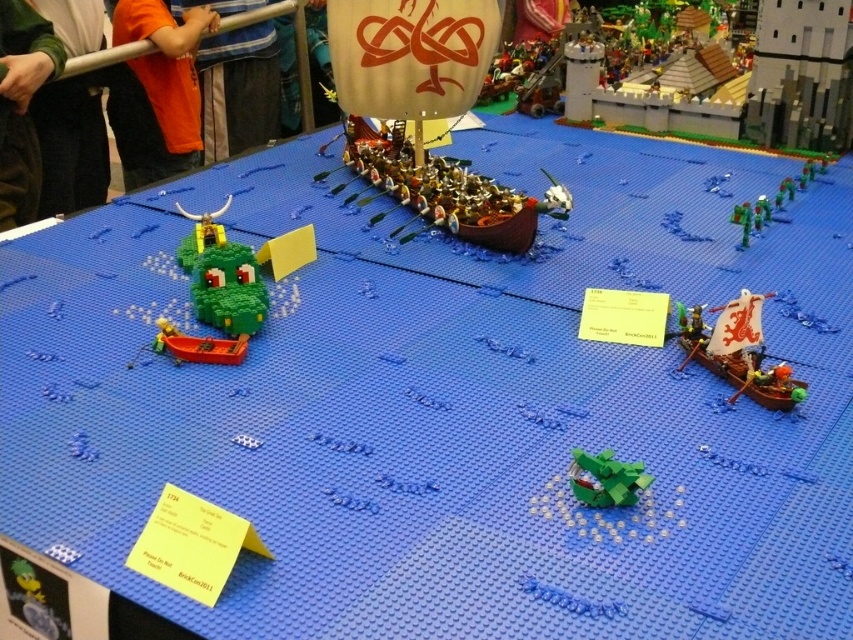
Question: Based on their relative distances, which object is nearer to the green fuzzy sweater at upper left?

Choices:
 (A) green matte dragon at lower center
 (B) orange t-shirt at upper left
 (C) orange shirt at upper left
 (D) green fabric shirt at upper left

Answer: (D)

Question: Is green fabric shirt at upper left to the left of green fuzzy sweater at upper left from the viewer's perspective?

Choices:
 (A) yes
 (B) no

Answer: (B)

Question: Observing the image, what is the correct spatial positioning of green fuzzy sweater at upper left in reference to white matte sailboat at right?

Choices:
 (A) left
 (B) right

Answer: (A)

Question: Which object is farther from the camera taking this photo?

Choices:
 (A) green fuzzy sweater at upper left
 (B) orange t-shirt at upper left

Answer: (B)

Question: Which point is farther to the camera?

Choices:
 (A) (84, 145)
 (B) (184, 45)
 (C) (21, 13)
 (D) (627, 465)

Answer: (A)

Question: Does orange t-shirt at upper left appear on the left side of orange shirt at upper left?

Choices:
 (A) yes
 (B) no

Answer: (A)